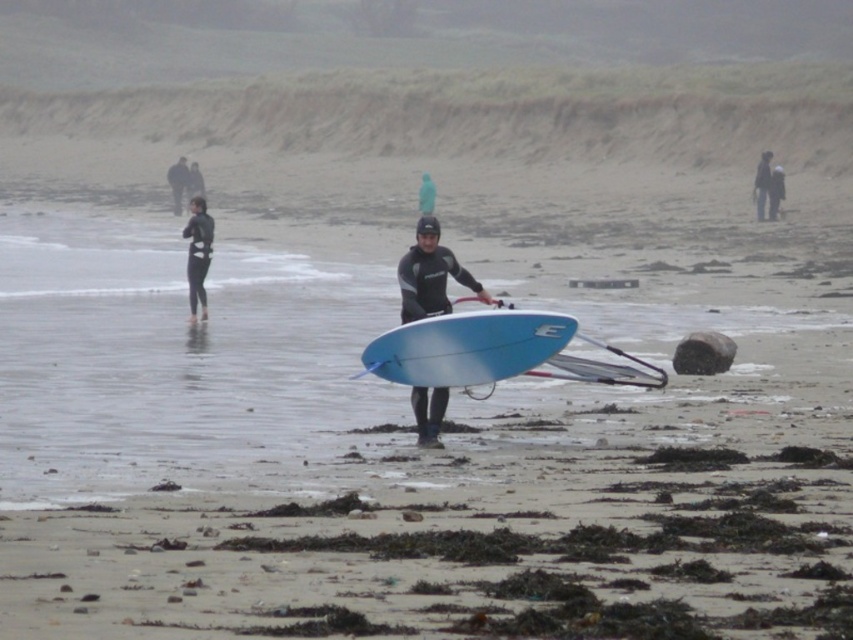
You are a photographer trying to capture a clear shot of the blue matte surfboard at center and the matte black wetsuit at center. From your current position, which object will appear closer to you in the photo?

The blue matte surfboard at center will appear closer to you in the photo since it is positioned in front of the matte black wetsuit at center.

You are a lifeguard on duty at the beach. You notice a person at point (430, 275) wearing a matte black wetsuit at center. Based on the scene description, what activity might this person be preparing to do?

The person at point (430, 275) wearing a matte black wetsuit at center is likely preparing to surf, as they are carrying a light blue surfboard with a white logo on its side and a leash attached, heading towards the water.